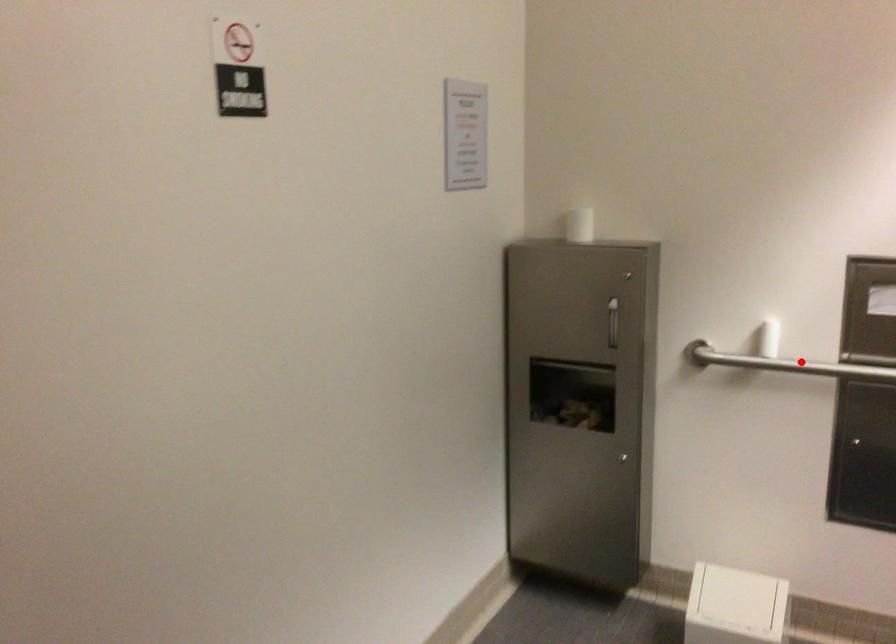
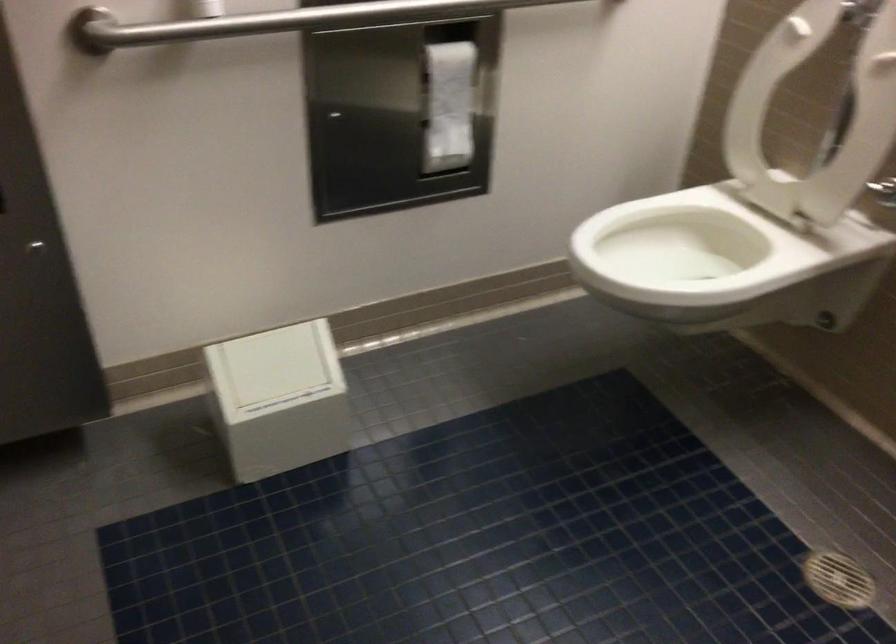
The point at the highlighted location is marked in the first image. Where is the corresponding point in the second image?

(279, 21)